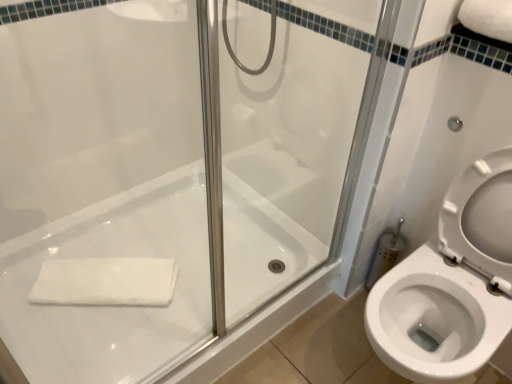
Identify the location of free point above white cotton bath towel at lower left, the 2th bath towel from the front (from a real-world perspective). 101,275.